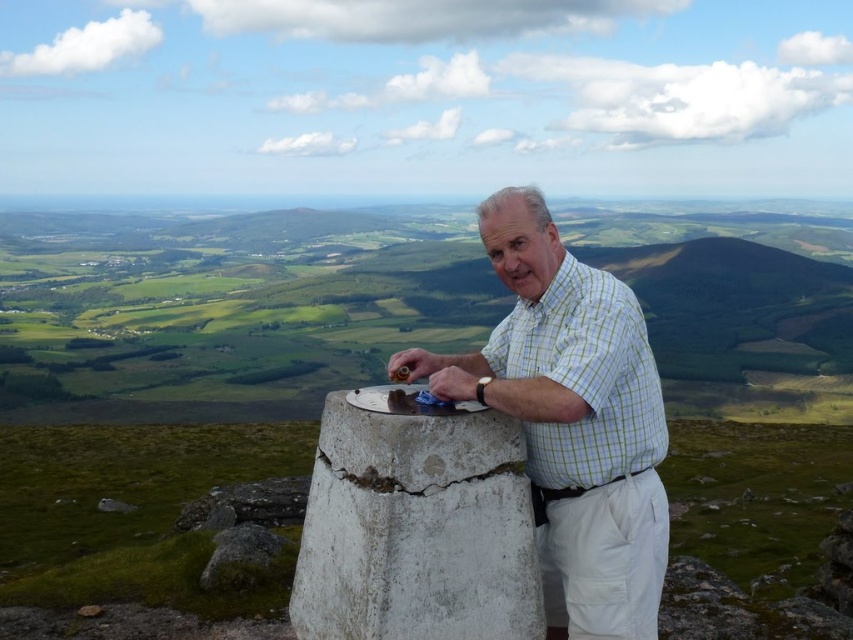
Question: Which is nearer to the white cracked cement at center?

Choices:
 (A) green checkered shirt at center
 (B) light green checkered shirt at center

Answer: (A)

Question: Is light green checkered shirt at center positioned behind white cracked cement at center?

Choices:
 (A) no
 (B) yes

Answer: (B)

Question: Is white cracked cement at center to the left of green checkered shirt at center from the viewer's perspective?

Choices:
 (A) no
 (B) yes

Answer: (B)

Question: Can you confirm if white cracked cement at center is smaller than green checkered shirt at center?

Choices:
 (A) no
 (B) yes

Answer: (B)

Question: Which object is the closest to the green checkered shirt at center?

Choices:
 (A) light green checkered shirt at center
 (B) white cracked cement at center

Answer: (A)

Question: Which of the following is the closest to the observer?

Choices:
 (A) (643, 528)
 (B) (448, 483)

Answer: (B)